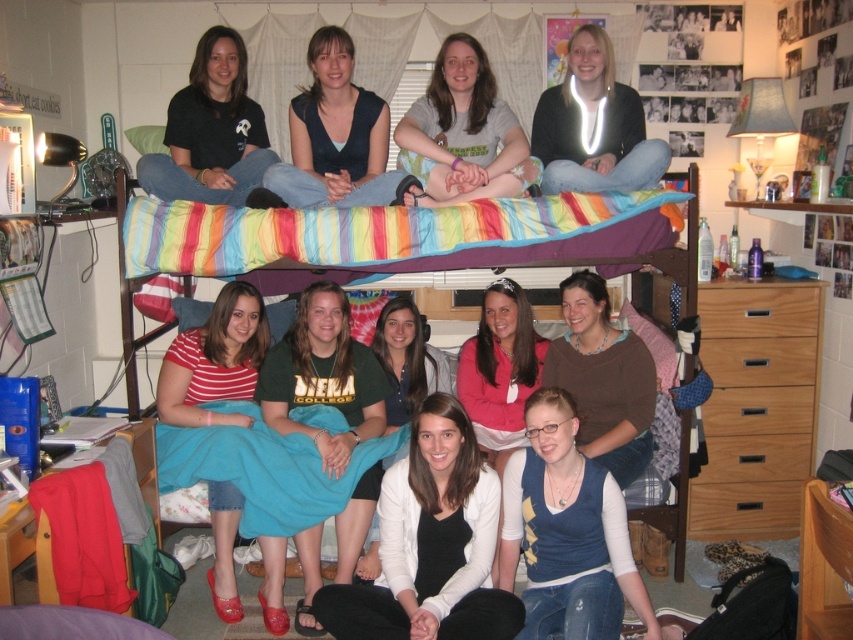
Question: Is denim vest at lower center to the right of striped cotton shirt at lower center from the viewer's perspective?

Choices:
 (A) no
 (B) yes

Answer: (B)

Question: Which object is the closest to the tie-dye fabric skirt at center?

Choices:
 (A) matte blue shirt at center
 (B) pink fleece sweater at center
 (C) matte white sweater at upper center

Answer: (B)

Question: Which of these objects is positioned closest to the pink fleece sweater at center?

Choices:
 (A) matte white sweater at upper center
 (B) striped cotton shirt at lower center

Answer: (A)

Question: Does striped cotton shirt at lower center appear over brown soft shirt at center?

Choices:
 (A) yes
 (B) no

Answer: (A)

Question: Among these objects, which one is farthest from the camera?

Choices:
 (A) brown soft shirt at center
 (B) striped cotton shirt at lower center
 (C) pink fleece sweater at center

Answer: (C)

Question: Is white matte sweater at center thinner than brown soft shirt at center?

Choices:
 (A) no
 (B) yes

Answer: (A)